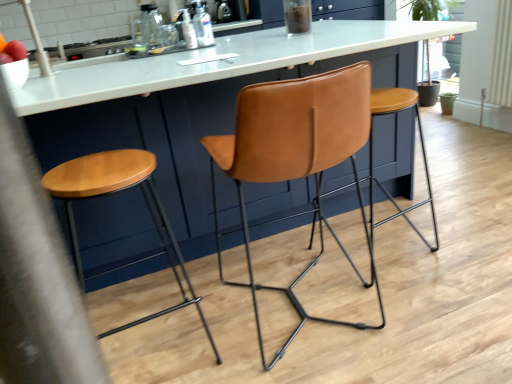
Question: Based on their positions, is translucent plastic bottle at upper center, the 2th bottle in the left-to-right sequence, located to the left or right of transparent plastic bottle at upper center, which is counted as the third bottle, starting from the left?

Choices:
 (A) left
 (B) right

Answer: (A)

Question: Considering the positions of point (183, 23) and point (206, 18), is point (183, 23) closer or farther from the camera than point (206, 18)?

Choices:
 (A) closer
 (B) farther

Answer: (A)

Question: Which of these objects is positioned closest to the leather stool at center, the 1th stool in the right-to-left sequence?

Choices:
 (A) translucent plastic bottle at upper center, the 2th bottle in the left-to-right sequence
 (B) cognac leather chair at center
 (C) matte brown stool at center, which is the 2th stool in right-to-left order
 (D) transparent glass bottle at upper center, which ranks as the 3th bottle in bottom-to-top order
 (E) transparent plastic bottle at upper center, the first bottle when ordered from right to left

Answer: (B)

Question: Based on their relative distances, which object is farther from the leather stool at center, acting as the second stool starting from the left?

Choices:
 (A) transparent glass bottle at upper center, the first bottle viewed from the left
 (B) cognac leather chair at center
 (C) translucent plastic bottle at upper center, the third bottle viewed from the top
 (D) matte brown stool at center, which is the 2th stool in right-to-left order
 (E) transparent plastic bottle at upper center, the first bottle when ordered from right to left

Answer: (A)